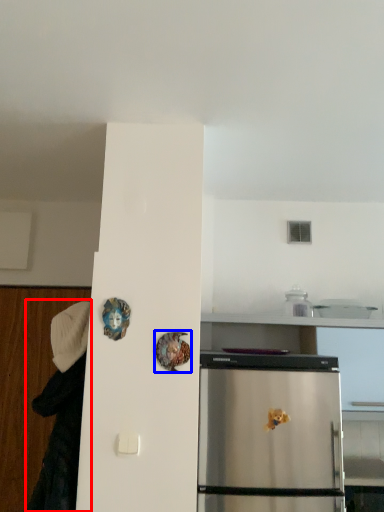
Question: Which object appears closest to the camera in this image, couple (highlighted by a red box) or art (highlighted by a blue box)?

Choices:
 (A) couple
 (B) art

Answer: (B)